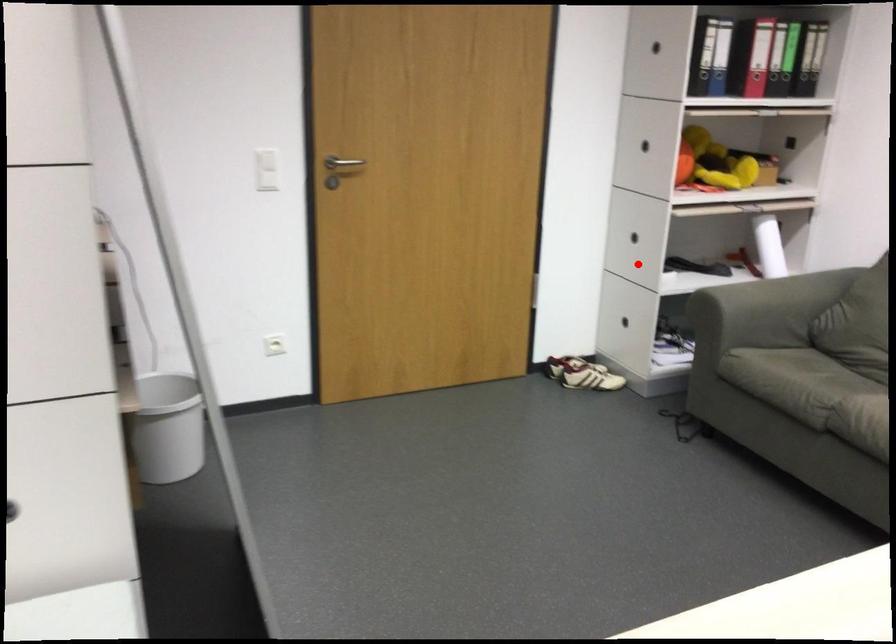
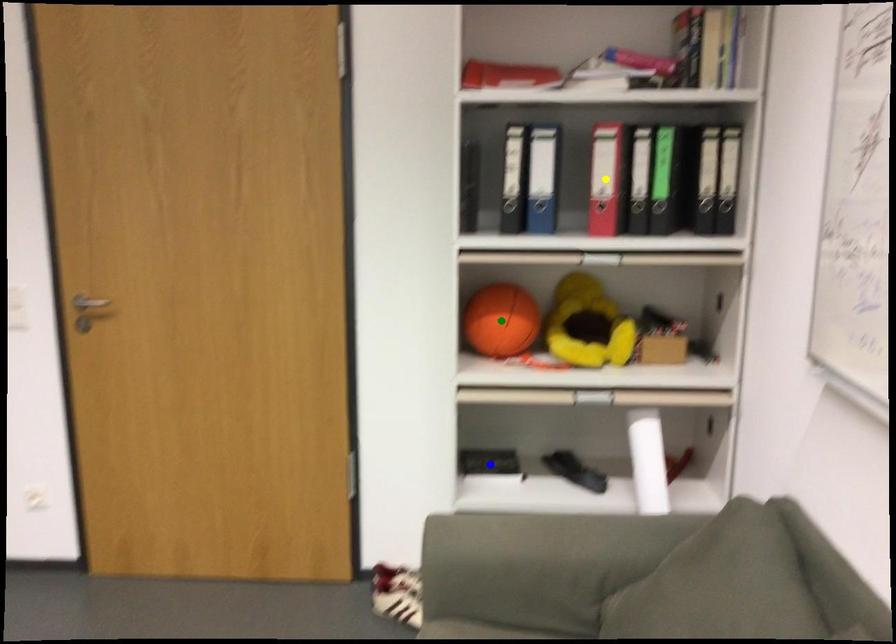
Question: I am providing you with two images of the same scene from different viewpoints. A red point is marked on the first image. You are given multiple points on the second image. Which mark in image 2 goes with the point in image 1?

Choices:
 (A) yellow point
 (B) green point
 (C) blue point

Answer: (C)